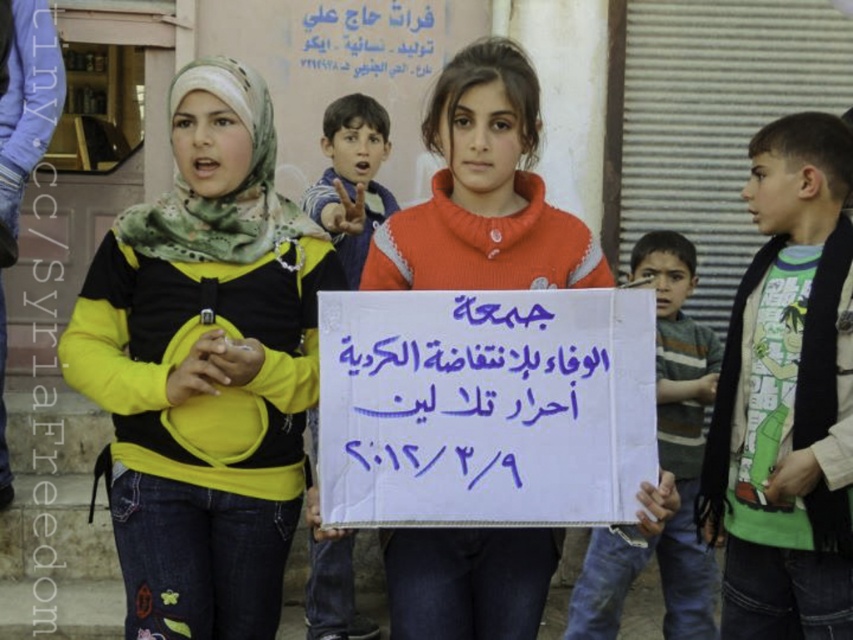
Based on the photo, which is above, yellow-green jersey at center or orange cotton shirt at center?

orange cotton shirt at center is above.

Is point (213, 600) behind point (479, 246)?

No, it is not.

Does point (114, 436) come behind point (444, 632)?

Yes, it is behind point (444, 632).

Find the location of a particular element. yellow-green jersey at center is located at coordinates (204, 369).

Between striped cotton shirt at center and white cardboard sign at center, which one appears on the right side from the viewer's perspective?

striped cotton shirt at center is more to the right.

Looking at this image, who is shorter, striped cotton shirt at center or white cardboard sign at center?

With less height is white cardboard sign at center.

At what (x,y) coordinates should I click in order to perform the action: click on striped cotton shirt at center. Please return your answer as a coordinate pair (x, y). Looking at the image, I should click on (662, 465).

At what (x,y) coordinates should I click in order to perform the action: click on striped cotton shirt at center. Please return your answer as a coordinate pair (x, y). The width and height of the screenshot is (853, 640). Looking at the image, I should click on (662, 465).

Based on the photo, who is lower down, yellow-green jersey at center or green printed t-shirt at center?

Positioned lower is green printed t-shirt at center.

Is yellow-green jersey at center wider than green printed t-shirt at center?

Yes, yellow-green jersey at center is wider than green printed t-shirt at center.

You are a GUI agent. You are given a task and a screenshot of the screen. Output one action in this format:
    pyautogui.click(x=<x>, y=<y>)
    Task: Click on the yellow-green jersey at center
    
    Given the screenshot: What is the action you would take?
    pyautogui.click(x=204, y=369)

The image size is (853, 640). Find the location of `yellow-green jersey at center`. yellow-green jersey at center is located at coordinates [204, 369].